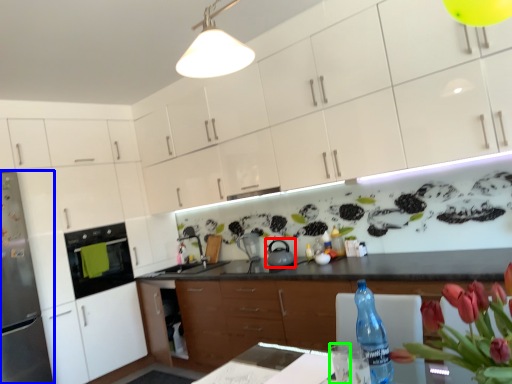
Question: Which is nearer to the tea pot (highlighted by a red box)? refrigerator (highlighted by a blue box) or water (highlighted by a green box).

Choices:
 (A) refrigerator
 (B) water

Answer: (B)